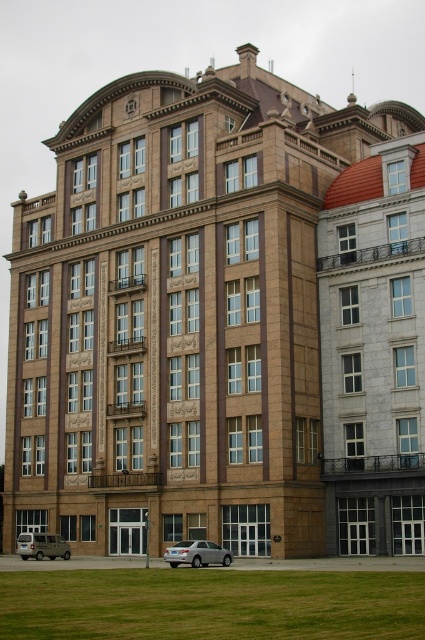
Describe the element at coordinates (374, 352) in the screenshot. I see `marble balcony at right` at that location.

Does point (374, 300) lie in front of point (184, 545)?

No.

Locate an element on the screen. marble balcony at right is located at coordinates (374, 352).

Who is shorter, marble balcony at right or green grass at lower center?

Standing shorter between the two is green grass at lower center.

Is marble balcony at right to the left of green grass at lower center from the viewer's perspective?

No, marble balcony at right is not to the left of green grass at lower center.

Between point (354, 522) and point (158, 592), which one is positioned behind?

Positioned behind is point (354, 522).

The width and height of the screenshot is (425, 640). I want to click on marble balcony at right, so click(x=374, y=352).

Locate an element on the screen. Image resolution: width=425 pixels, height=640 pixels. marble balcony at right is located at coordinates (374, 352).